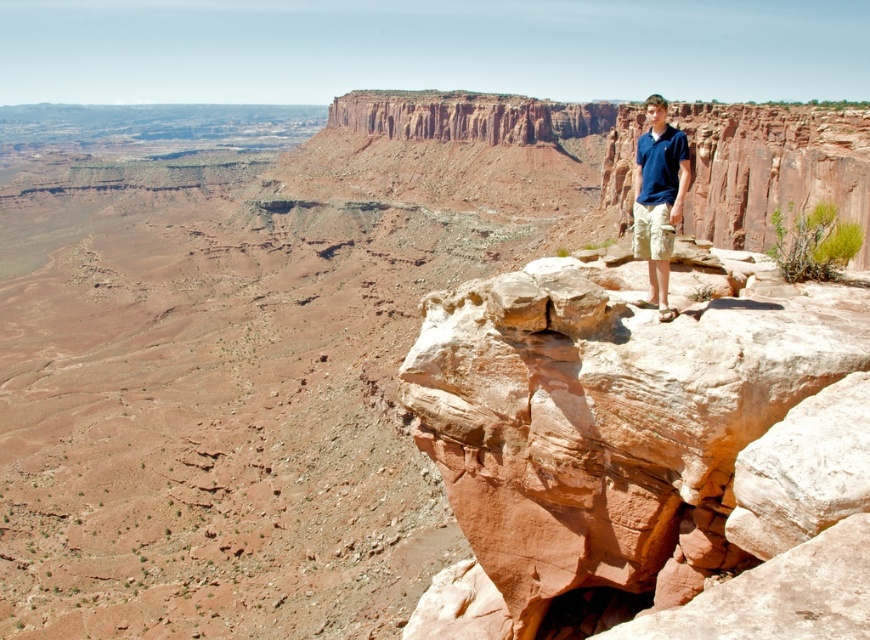
You are a photographer planning to capture the rustic sandstone rock at upper right and the blue cotton polo shirt at upper right in a single frame. Based on their sizes in the scene, which object should you focus on first to ensure both are clearly visible in your composition?

The rustic sandstone rock at upper right occupies less space than the blue cotton polo shirt at upper right, so you should focus on the smaller rustic sandstone rock at upper right first to ensure both are clearly visible in the composition.